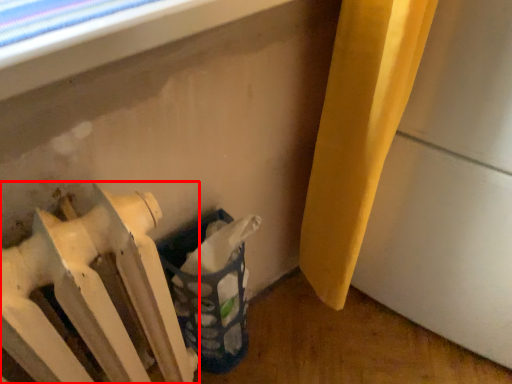
Question: From the image's perspective, what is the correct spatial relationship of radiator (annotated by the red box) in relation to laundry basket?

Choices:
 (A) above
 (B) below

Answer: (B)